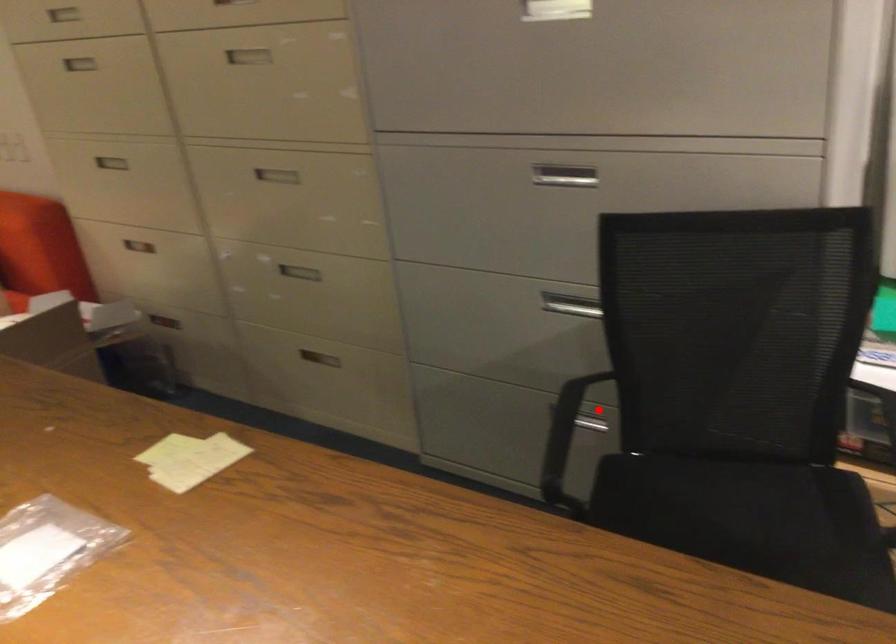
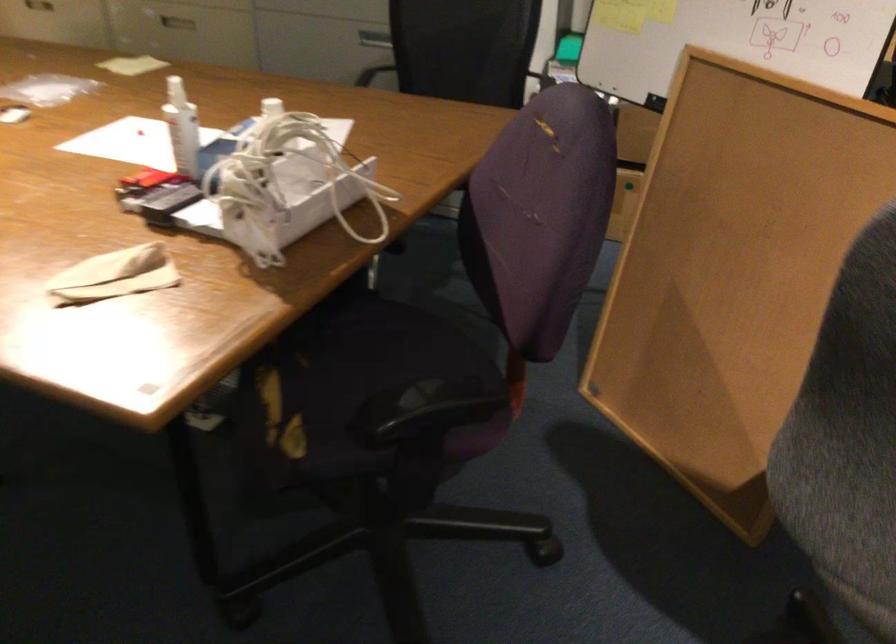
Question: I am providing you with two images of the same scene from different viewpoints. A red point is marked on the first image. Can you still see the location of the red point in image 2?

Choices:
 (A) Yes
 (B) No

Answer: (B)